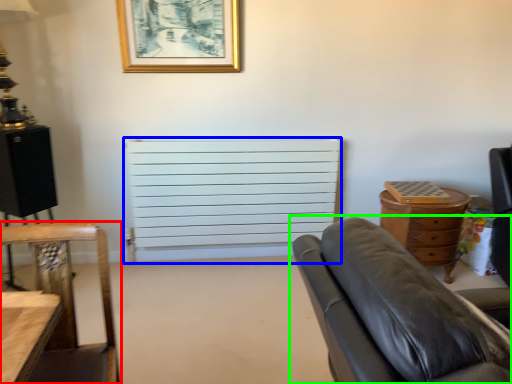
Question: Which object is positioned closest to chair (highlighted by a red box)? Select from radiator (highlighted by a blue box) and studio couch (highlighted by a green box).

Choices:
 (A) radiator
 (B) studio couch

Answer: (B)